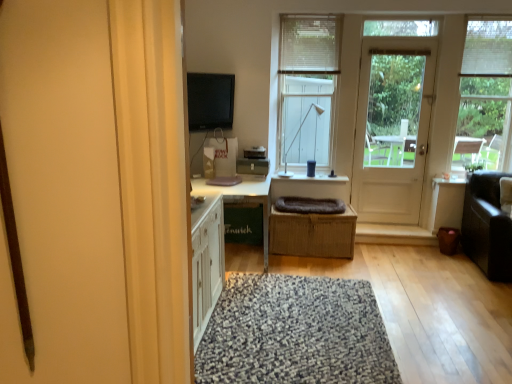
At what (x,y) coordinates should I click in order to perform the action: click on free location above speckled woolen rug at center (from a real-world perspective). Please return your answer as a coordinate pair (x, y). The height and width of the screenshot is (384, 512). Looking at the image, I should click on (296, 317).